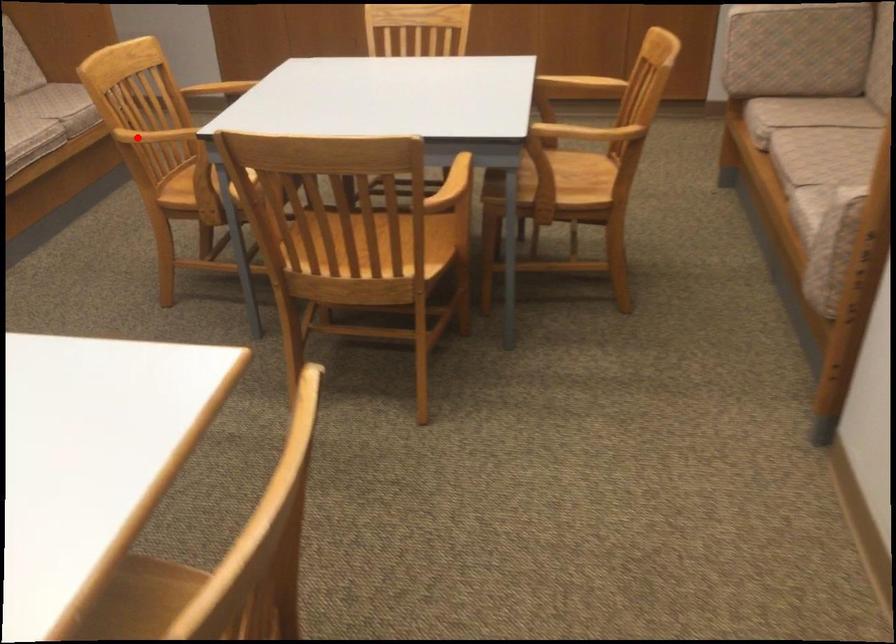
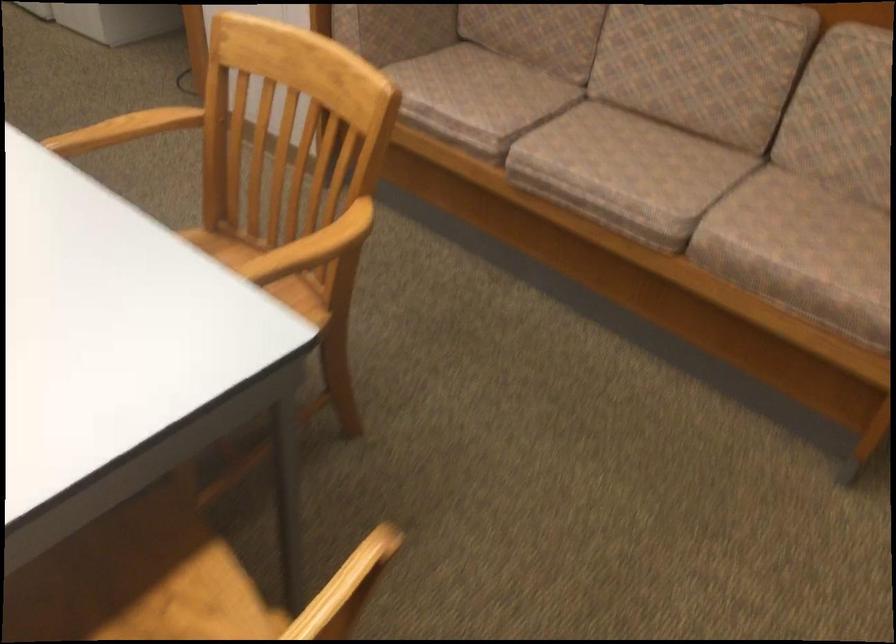
The point at the highlighted location is marked in the first image. Where is the corresponding point in the second image?

(151, 122)